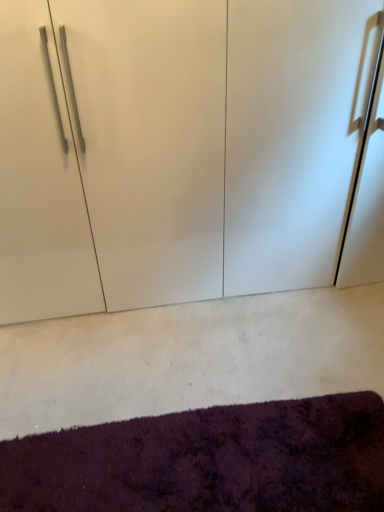
Question: Is shaggy purple mat at lower center spatially inside white glossy cupboard at center, or outside of it?

Choices:
 (A) outside
 (B) inside

Answer: (A)

Question: Based on their sizes in the image, would you say shaggy purple mat at lower center is bigger or smaller than white glossy cupboard at center?

Choices:
 (A) small
 (B) big

Answer: (A)

Question: Is shaggy purple mat at lower center taller or shorter than white glossy cupboard at center?

Choices:
 (A) tall
 (B) short

Answer: (B)

Question: In terms of height, does white glossy cupboard at center look taller or shorter compared to shaggy purple mat at lower center?

Choices:
 (A) short
 (B) tall

Answer: (B)

Question: Would you say white glossy cupboard at center is inside or outside shaggy purple mat at lower center?

Choices:
 (A) outside
 (B) inside

Answer: (A)

Question: Based on their positions, is white glossy cupboard at center located to the left or right of shaggy purple mat at lower center?

Choices:
 (A) right
 (B) left

Answer: (A)

Question: Is white glossy cupboard at center wider or thinner than shaggy purple mat at lower center?

Choices:
 (A) wide
 (B) thin

Answer: (A)